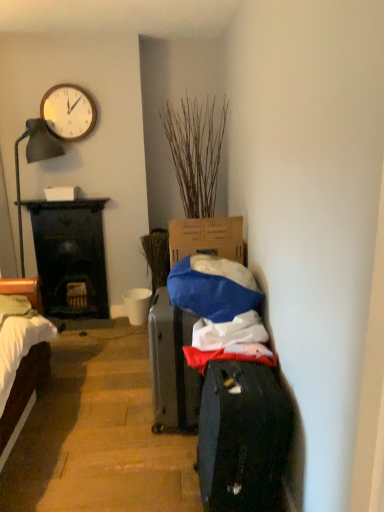
Question: From the image's perspective, is wooden clock at upper left on top of dry grass at center?

Choices:
 (A) no
 (B) yes

Answer: (B)

Question: Is wooden clock at upper left not close to dry grass at center?

Choices:
 (A) yes
 (B) no

Answer: (B)

Question: Does wooden clock at upper left have a greater height compared to dry grass at center?

Choices:
 (A) yes
 (B) no

Answer: (B)

Question: Would you say wooden clock at upper left contains dry grass at center?

Choices:
 (A) no
 (B) yes

Answer: (A)

Question: Considering the relative sizes of wooden clock at upper left and dry grass at center in the image provided, is wooden clock at upper left wider than dry grass at center?

Choices:
 (A) no
 (B) yes

Answer: (A)

Question: Looking at the image, does dark wood desk at left seem bigger or smaller compared to white matte bucket at center?

Choices:
 (A) small
 (B) big

Answer: (B)

Question: From the image's perspective, relative to white matte bucket at center, is dark wood desk at left above or below?

Choices:
 (A) above
 (B) below

Answer: (A)

Question: Is dark wood desk at left taller or shorter than white matte bucket at center?

Choices:
 (A) tall
 (B) short

Answer: (A)

Question: Is point (72, 222) closer or farther from the camera than point (129, 309)?

Choices:
 (A) closer
 (B) farther

Answer: (A)

Question: From the image's perspective, is dry grass at center positioned above or below dark gray fabric suitcase at center?

Choices:
 (A) below
 (B) above

Answer: (B)

Question: From a real-world perspective, is dry grass at center physically located above or below dark gray fabric suitcase at center?

Choices:
 (A) above
 (B) below

Answer: (A)

Question: Do you think dry grass at center is within dark gray fabric suitcase at center, or outside of it?

Choices:
 (A) outside
 (B) inside

Answer: (A)

Question: Looking at the image, does dry grass at center seem bigger or smaller compared to dark gray fabric suitcase at center?

Choices:
 (A) big
 (B) small

Answer: (A)

Question: Which is correct: wooden clock at upper left is inside dark wood desk at left, or outside of it?

Choices:
 (A) outside
 (B) inside

Answer: (A)

Question: In terms of width, does wooden clock at upper left look wider or thinner when compared to dark wood desk at left?

Choices:
 (A) wide
 (B) thin

Answer: (B)